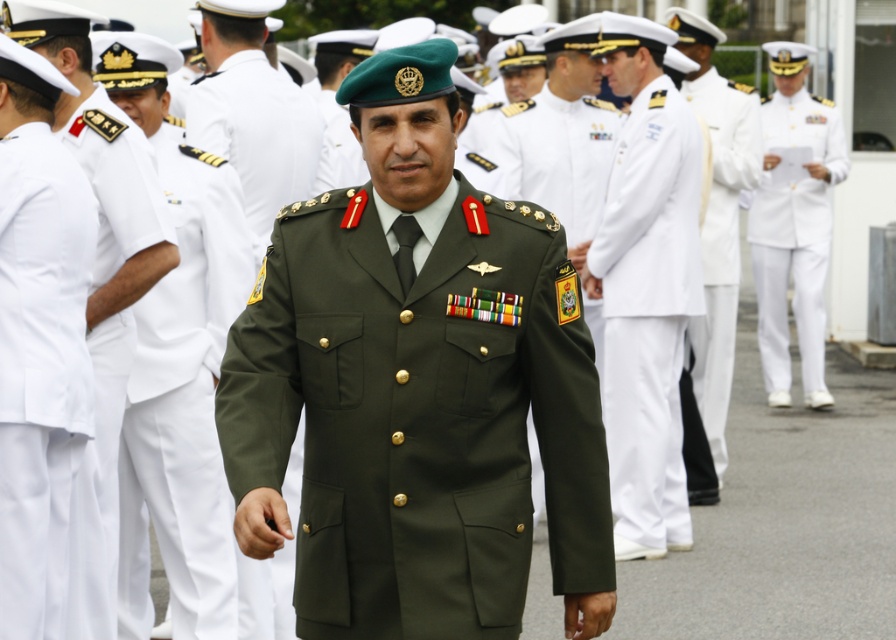
In the scene shown: Can you confirm if green matte uniform at center is bigger than white cotton uniform at center?

Actually, green matte uniform at center might be smaller than white cotton uniform at center.

Between point (210, 406) and point (730, 230), which one is positioned behind?

The point (730, 230) is more distant.

This screenshot has width=896, height=640. What do you see at coordinates (183, 406) in the screenshot?
I see `green matte uniform at center` at bounding box center [183, 406].

The width and height of the screenshot is (896, 640). Find the location of `green matte uniform at center`. green matte uniform at center is located at coordinates (183, 406).

Who is higher up, white cotton dress uniform at right or green matte beret at center?

white cotton dress uniform at right is higher up.

Does white cotton dress uniform at right have a larger size compared to green matte beret at center?

Yes, white cotton dress uniform at right is bigger than green matte beret at center.

Between point (774, 257) and point (259, 134), which one is positioned behind?

Point (774, 257)

Image resolution: width=896 pixels, height=640 pixels. I want to click on white cotton dress uniform at right, so 794,236.

Who is higher up, white cotton dress uniform at right or white cotton uniform at center?

Positioned higher is white cotton dress uniform at right.

Which of these two, white cotton dress uniform at right or white cotton uniform at center, stands taller?

white cotton uniform at center

What do you see at coordinates (794, 236) in the screenshot?
I see `white cotton dress uniform at right` at bounding box center [794, 236].

The image size is (896, 640). Identify the location of white cotton dress uniform at right. (794, 236).